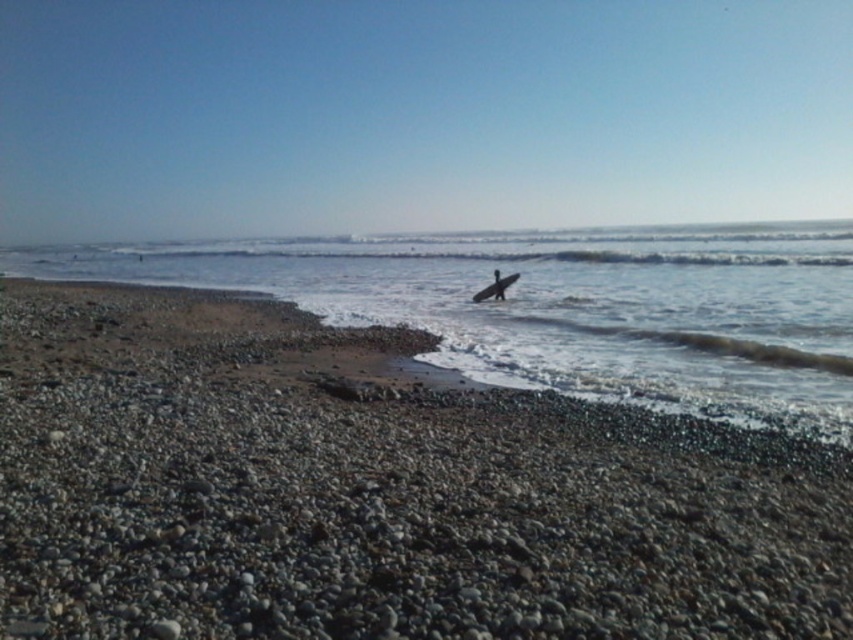
Who is higher up, smooth pebbles at center or smooth dark skin at center?

Positioned higher is smooth dark skin at center.

Is smooth pebbles at center smaller than smooth dark skin at center?

No, smooth pebbles at center is not smaller than smooth dark skin at center.

Based on the photo, who is more forward, (341, 531) or (495, 276)?

Positioned in front is point (341, 531).

Locate an element on the screen. The image size is (853, 640). smooth pebbles at center is located at coordinates (375, 490).

Does clear water at center appear on the right side of smooth dark skin at center?

Incorrect, clear water at center is not on the right side of smooth dark skin at center.

Identify the location of clear water at center. (563, 307).

Describe the element at coordinates (375, 490) in the screenshot. I see `smooth pebbles at center` at that location.

Can you confirm if smooth pebbles at center is taller than clear water at center?

Incorrect, smooth pebbles at center's height is not larger of clear water at center's.

Is point (198, 390) in front of point (337, 292)?

Yes, it is in front of point (337, 292).

Locate an element on the screen. smooth pebbles at center is located at coordinates (375, 490).